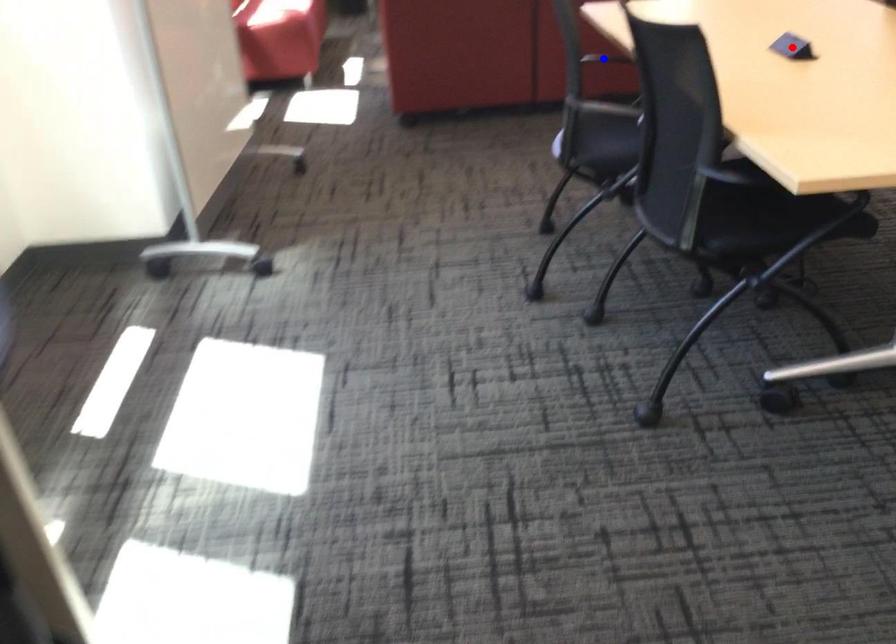
Question: In the image, two points are highlighted. Which point is nearer to the camera? Reply with the corresponding letter.

Choices:
 (A) blue point
 (B) red point

Answer: (B)